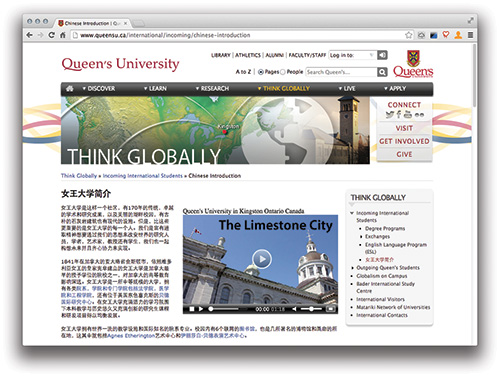
This screenshot has height=377, width=500. I want to click on picture, so click(x=196, y=109).